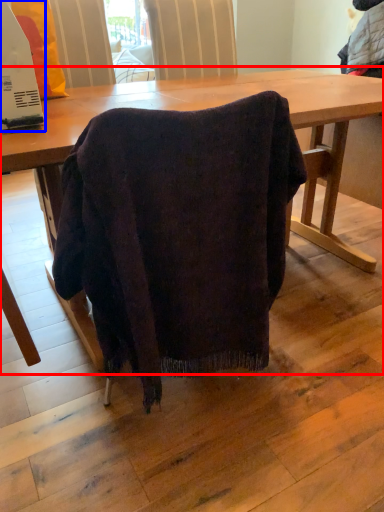
Question: Which object is further to the camera taking this photo, table (highlighted by a red box) or appliance (highlighted by a blue box)?

Choices:
 (A) table
 (B) appliance

Answer: (B)